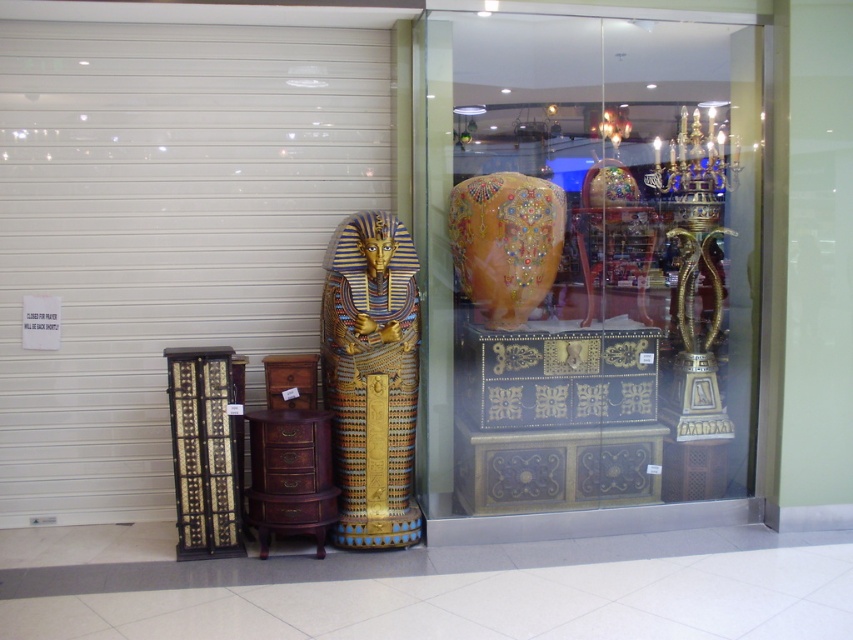
Question: Is matte gold vase at center wider than gold metallic sarcophagus at center?

Choices:
 (A) yes
 (B) no

Answer: (A)

Question: Can you confirm if gold metallic sarcophagus at center is positioned to the left of golden glossy vase at center?

Choices:
 (A) yes
 (B) no

Answer: (A)

Question: Which object is the closest to the golden glossy vase at center?

Choices:
 (A) gold metallic sarcophagus at center
 (B) matte gold vase at center

Answer: (B)

Question: Among these objects, which one is farthest from the camera?

Choices:
 (A) gold metallic sarcophagus at center
 (B) matte gold vase at center

Answer: (B)

Question: Which object appears farthest from the camera in this image?

Choices:
 (A) matte gold vase at center
 (B) golden glossy vase at center
 (C) gold metallic sarcophagus at center

Answer: (B)

Question: Is the position of gold metallic sarcophagus at center less distant than that of golden glossy vase at center?

Choices:
 (A) yes
 (B) no

Answer: (A)